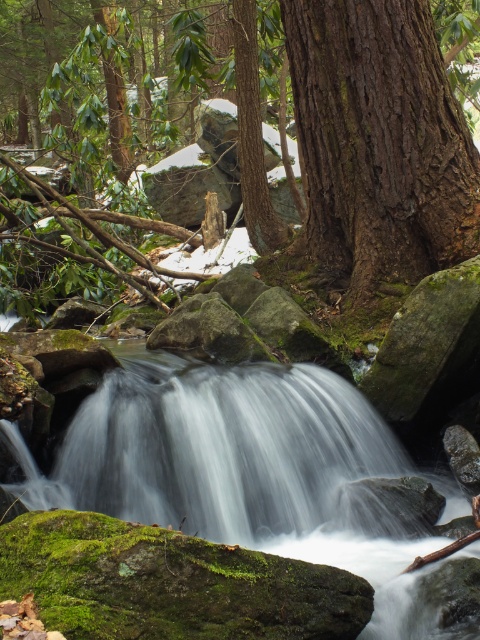
From the picture: You are standing at the edge of the forest stream and notice a point marked at coordinates (245,468). What is located at this point?

At point (245,468) lies white smooth water at center.

You are a photographer standing at the edge of the forest. You want to capture a photo of the brown rough tree at center and the white smooth water at center in the same frame. If your camera can focus on objects within 5 meters, will both subjects be in focus?

The brown rough tree at center is 5.18 meters from white smooth water at center. Since the distance between them is slightly over 5 meters, the camera might struggle to keep both in focus simultaneously.